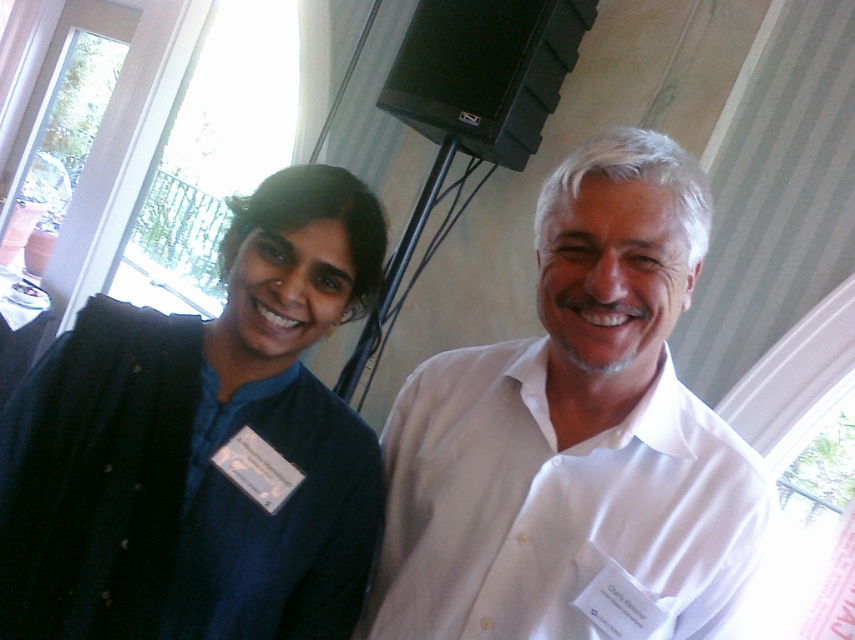
Looking at this image, you are organizing a photo shoot and need to arrange the two individuals based on their shirt positions. If the velvet blue shirt at left needs to be positioned to the left of the white cotton shirt at center in the final photo, does their current arrangement already satisfy this requirement?

Yes, the current arrangement already satisfies the requirement because the white cotton shirt at center is to the right of the velvet blue shirt at left, meaning the velvet blue shirt at left is already positioned to the left of the white cotton shirt at center.

You are organizing a photo shoot and need to adjust the positions of the white cotton shirt at center and the velvet blue shirt at left to ensure both are visible in the frame. Based on their current positions, which shirt should you move backward to achieve this?

The velvet blue shirt at left should be moved backward because the white cotton shirt at center is currently in front of it, so moving the velvet blue shirt at left further back will allow both shirts to be visible in the frame.

You are organizing a photo shoot and need to arrange the participants based on their shirt positions. If the velvet blue shirt at left must be placed above the white cotton shirt at center in the final photo, does the current arrangement already satisfy this requirement?

The white cotton shirt at center is currently below the velvet blue shirt at left, so the current arrangement already satisfies the requirement that the velvet blue shirt at left is placed above the white cotton shirt at center.